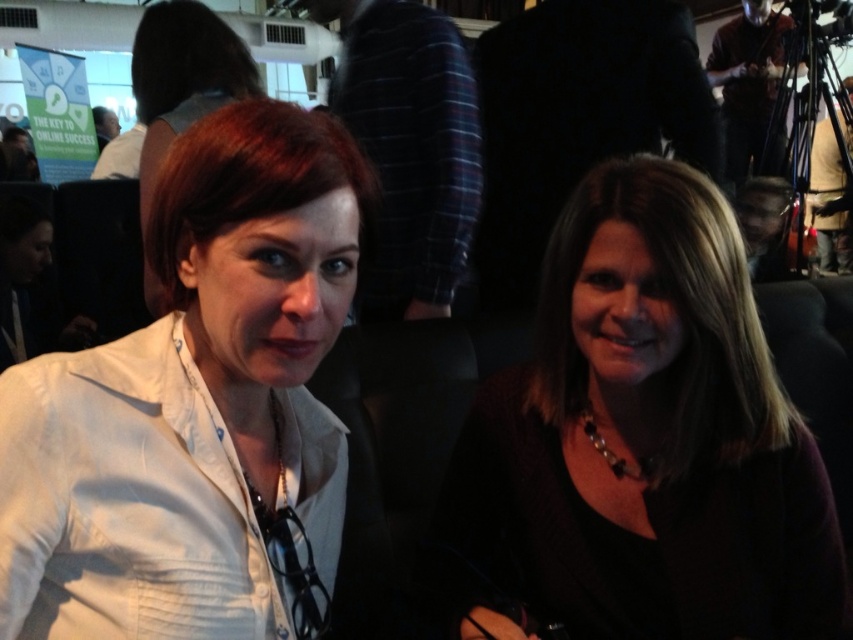
Question: Does white matte blazer at center have a smaller size compared to matte white shirt at center?

Choices:
 (A) no
 (B) yes

Answer: (B)

Question: Which point is farther from the camera taking this photo?

Choices:
 (A) (637, 536)
 (B) (143, 202)

Answer: (B)

Question: Which object appears closest to the camera in this image?

Choices:
 (A) matte white shirt at center
 (B) dark brown hair at center
 (C) white matte blazer at center

Answer: (C)

Question: Can you confirm if white matte blazer at center is bigger than dark brown hair at center?

Choices:
 (A) yes
 (B) no

Answer: (B)

Question: Which of these objects is positioned farthest from the dark brown hair at center?

Choices:
 (A) white matte blazer at center
 (B) matte white shirt at center

Answer: (B)

Question: Can you confirm if white matte blazer at center is positioned below dark brown hair at center?

Choices:
 (A) yes
 (B) no

Answer: (B)